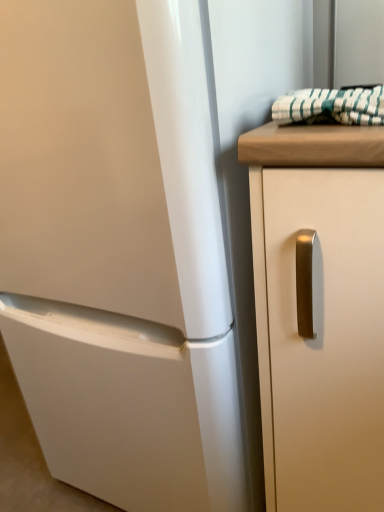
Question: Should I look upward or downward to see white matte cabinet handle at right?

Choices:
 (A) up
 (B) down

Answer: (B)

Question: Is green striped fabric at upper right not near white matte cabinet handle at right?

Choices:
 (A) yes
 (B) no

Answer: (B)

Question: Considering the relative sizes of green striped fabric at upper right and white matte cabinet handle at right in the image provided, is green striped fabric at upper right wider than white matte cabinet handle at right?

Choices:
 (A) no
 (B) yes

Answer: (A)

Question: Is white matte cabinet handle at right completely or partially inside green striped fabric at upper right?

Choices:
 (A) no
 (B) yes

Answer: (A)

Question: Is green striped fabric at upper right positioned behind white matte cabinet handle at right?

Choices:
 (A) yes
 (B) no

Answer: (A)

Question: Is green striped fabric at upper right touching white matte cabinet handle at right?

Choices:
 (A) no
 (B) yes

Answer: (A)

Question: Does green striped fabric at upper right appear on the left side of white matte cabinet handle at right?

Choices:
 (A) no
 (B) yes

Answer: (B)

Question: From a real-world perspective, does white matte cabinet handle at right stand above green striped fabric at upper right?

Choices:
 (A) no
 (B) yes

Answer: (A)

Question: From the image's perspective, would you say white matte cabinet handle at right is shown under green striped fabric at upper right?

Choices:
 (A) no
 (B) yes

Answer: (B)

Question: Is white matte cabinet handle at right next to green striped fabric at upper right and touching it?

Choices:
 (A) no
 (B) yes

Answer: (A)

Question: Would you consider white matte cabinet handle at right to be distant from green striped fabric at upper right?

Choices:
 (A) yes
 (B) no

Answer: (B)

Question: Does white matte cabinet handle at right appear on the right side of green striped fabric at upper right?

Choices:
 (A) yes
 (B) no

Answer: (A)

Question: Is white matte cabinet handle at right oriented away from green striped fabric at upper right?

Choices:
 (A) no
 (B) yes

Answer: (A)

Question: Is point (352, 121) closer or farther from the camera than point (281, 134)?

Choices:
 (A) farther
 (B) closer

Answer: (A)